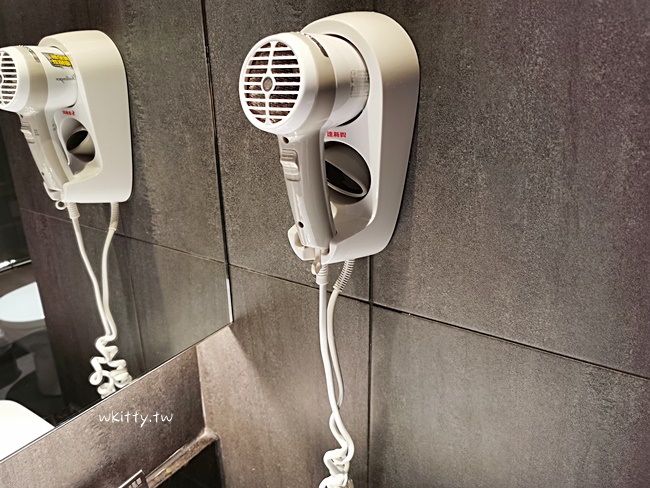
Find the location of `reflection of electrical cord`. reflection of electrical cord is located at coordinates (92, 277).